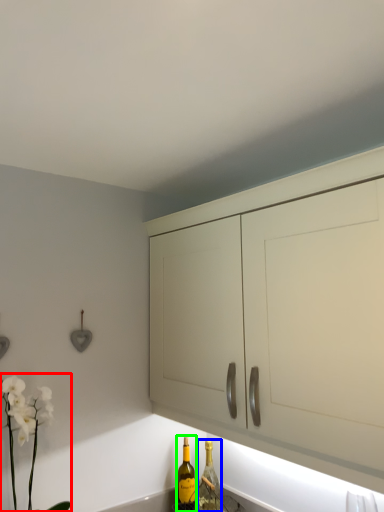
Question: Based on their relative distances, which object is farther from floral arrangement (highlighted by a red box)? Choose from bottle (highlighted by a blue box) and bottle (highlighted by a green box).

Choices:
 (A) bottle
 (B) bottle

Answer: (A)